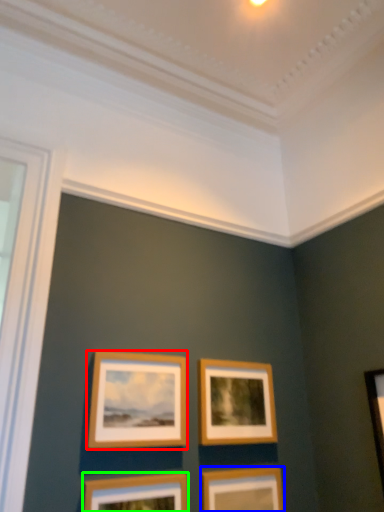
Question: Considering the real-world distances, which object is farthest from picture frame (highlighted by a red box)? picture frame (highlighted by a blue box) or picture frame (highlighted by a green box)?

Choices:
 (A) picture frame
 (B) picture frame

Answer: (A)